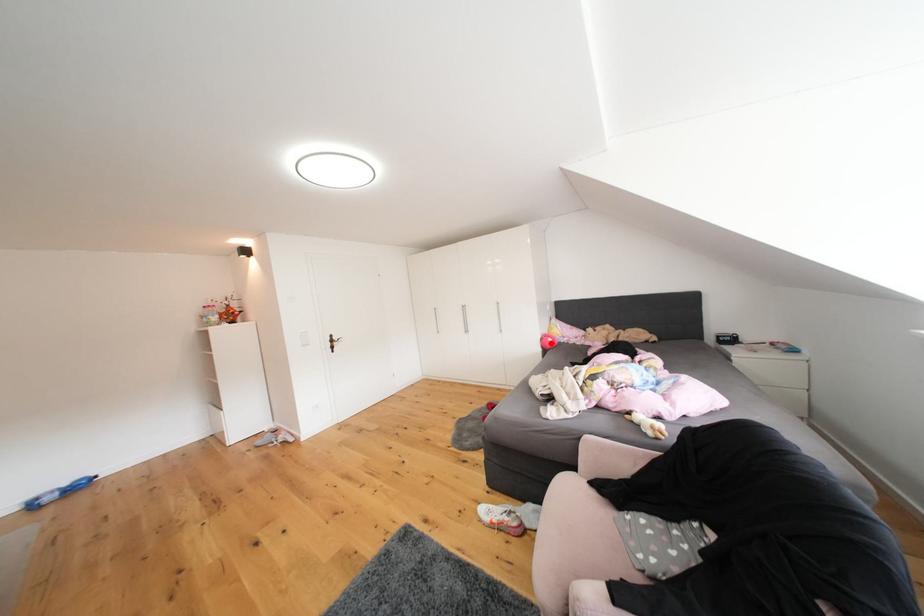
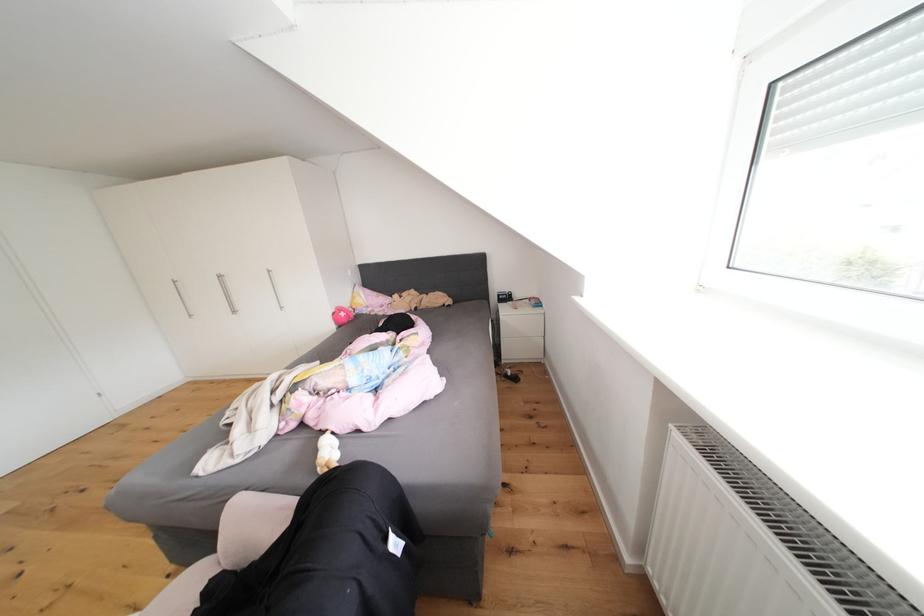
Question: I am providing you with two images of the same scene from different viewpoints. Given a red point in image1, look at the same physical point in image2. Is it:

Choices:
 (A) Closer to the viewpoint
 (B) Farther from the viewpoint

Answer: (A)